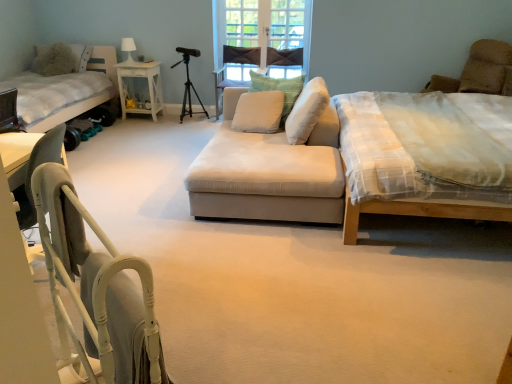
Question: Is fluffy white pillow at upper left, the 4th pillow positioned from the front, at the back of white soft cushion at center, which is counted as the third pillow, starting from the front?

Choices:
 (A) no
 (B) yes

Answer: (A)

Question: Is the position of white soft cushion at center, the second pillow when ordered from right to left, more distant than that of fluffy white pillow at upper left, the 4th pillow positioned from the front?

Choices:
 (A) no
 (B) yes

Answer: (A)

Question: From the image's perspective, would you say white soft cushion at center, which is counted as the third pillow, starting from the front, is shown under fluffy white pillow at upper left, which appears as the fourth pillow when viewed from the right?

Choices:
 (A) yes
 (B) no

Answer: (A)

Question: Does white soft cushion at center, which is counted as the third pillow, starting from the front, have a greater width compared to fluffy white pillow at upper left, the 1th pillow viewed from the left?

Choices:
 (A) yes
 (B) no

Answer: (B)

Question: From a real-world perspective, is white soft cushion at center, which is counted as the third pillow, starting from the front, under fluffy white pillow at upper left, the 4th pillow positioned from the front?

Choices:
 (A) no
 (B) yes

Answer: (B)

Question: From the image's perspective, is metallic tripod at center positioned above or below brown suede armchair at upper right?

Choices:
 (A) above
 (B) below

Answer: (B)

Question: In the image, is metallic tripod at center positioned in front of or behind brown suede armchair at upper right?

Choices:
 (A) front
 (B) behind

Answer: (B)

Question: Would you say metallic tripod at center is to the left or to the right of brown suede armchair at upper right in the picture?

Choices:
 (A) right
 (B) left

Answer: (B)

Question: From a real-world perspective, is metallic tripod at center positioned above or below brown suede armchair at upper right?

Choices:
 (A) above
 (B) below

Answer: (B)

Question: Is white soft cushion at center, arranged as the second pillow when viewed from the front, bigger or smaller than white fabric folding chair at lower left?

Choices:
 (A) big
 (B) small

Answer: (B)

Question: In terms of height, does white soft cushion at center, which is the second pillow in left-to-right order, look taller or shorter compared to white fabric folding chair at lower left?

Choices:
 (A) short
 (B) tall

Answer: (A)

Question: In terms of width, does white soft cushion at center, acting as the 3th pillow starting from the right, look wider or thinner when compared to white fabric folding chair at lower left?

Choices:
 (A) thin
 (B) wide

Answer: (B)

Question: Is point (269, 115) closer or farther from the camera than point (75, 296)?

Choices:
 (A) farther
 (B) closer

Answer: (A)

Question: Considering the positions of brown suede armchair at upper right and white fabric bed at left, the second bed in the right-to-left sequence, in the image, is brown suede armchair at upper right wider or thinner than white fabric bed at left, the second bed in the right-to-left sequence,?

Choices:
 (A) thin
 (B) wide

Answer: (A)

Question: Considering the positions of brown suede armchair at upper right and white fabric bed at left, the second bed in the right-to-left sequence, in the image, is brown suede armchair at upper right bigger or smaller than white fabric bed at left, the second bed in the right-to-left sequence,?

Choices:
 (A) big
 (B) small

Answer: (B)